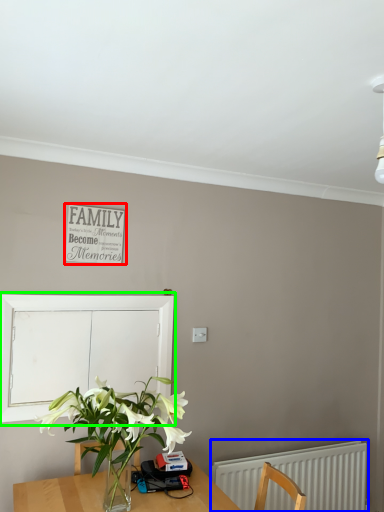
Question: Which object is the closest to the bulletin board (highlighted by a red box)? Choose among these: radiator (highlighted by a blue box) or window screen (highlighted by a green box).

Choices:
 (A) radiator
 (B) window screen

Answer: (B)